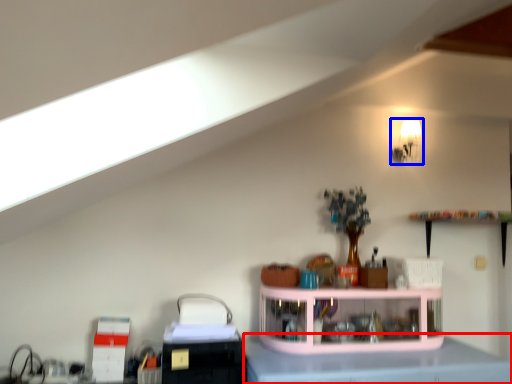
Question: Which of the following is the closest to the observer, counter top (highlighted by a red box) or light fixture (highlighted by a blue box)?

Choices:
 (A) counter top
 (B) light fixture

Answer: (A)